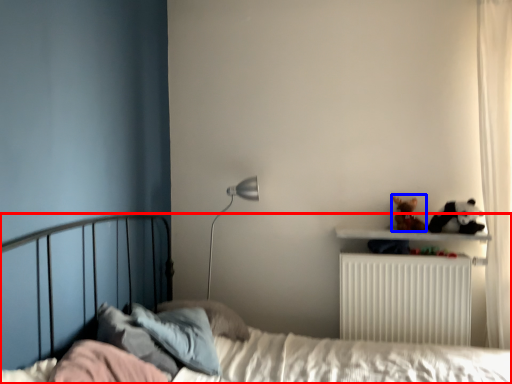
Question: Which object appears closest to the camera in this image, bed (highlighted by a red box) or toy (highlighted by a blue box)?

Choices:
 (A) bed
 (B) toy

Answer: (A)